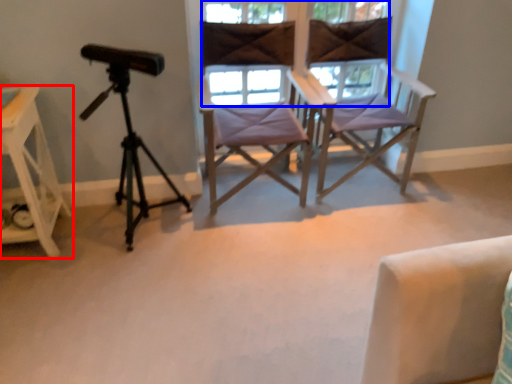
Question: Which object is closer to the camera taking this photo, furniture (highlighted by a red box) or window (highlighted by a blue box)?

Choices:
 (A) furniture
 (B) window

Answer: (A)